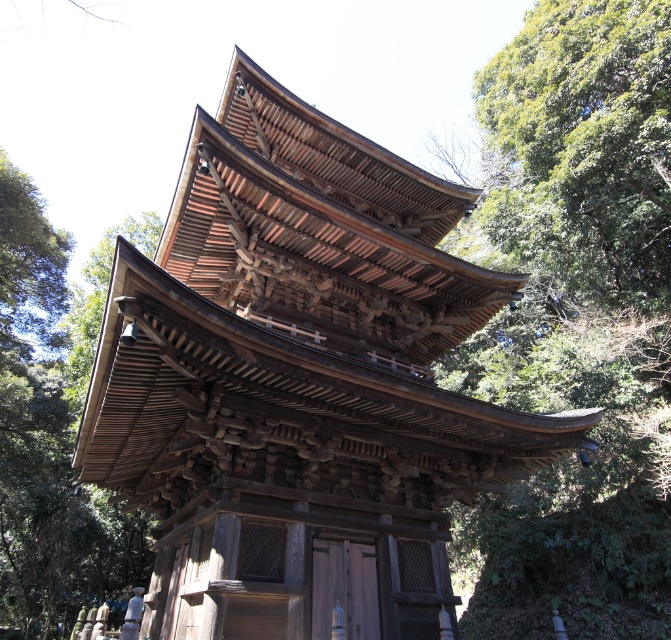
Question: Does wooden temple at center appear over green leafy tree at upper right?

Choices:
 (A) yes
 (B) no

Answer: (B)

Question: Is the position of wooden temple at center more distant than that of green leafy tree at upper right?

Choices:
 (A) no
 (B) yes

Answer: (A)

Question: Does wooden temple at center have a greater width compared to green leafy tree at upper right?

Choices:
 (A) no
 (B) yes

Answer: (B)

Question: Which point is closer to the camera?

Choices:
 (A) wooden temple at center
 (B) green leafy tree at upper right

Answer: (A)